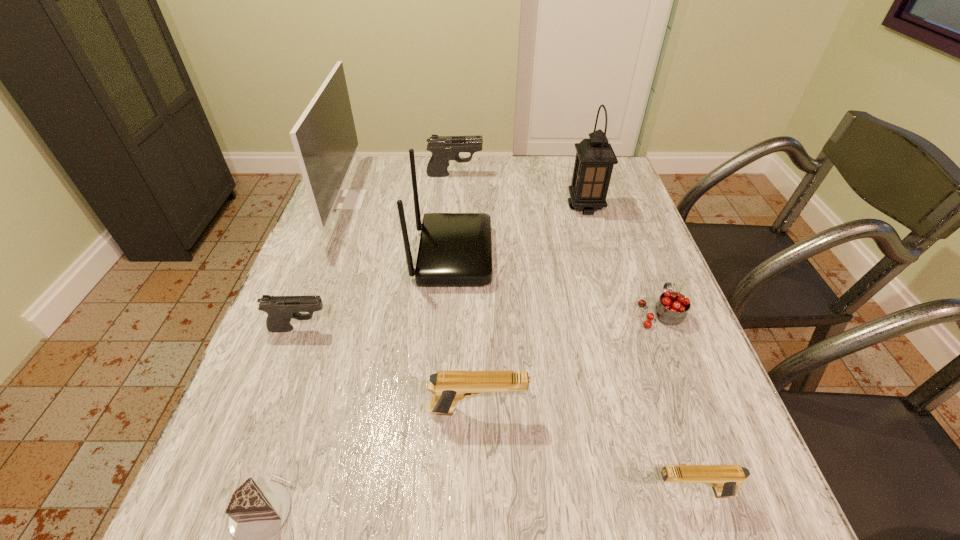
This screenshot has width=960, height=540. What are the coordinates of `cherry that is at the right edge` in the screenshot? It's located at (672, 308).

I want to click on pistol that is at the right edge, so click(725, 479).

Where is `object present at the far left corner`? object present at the far left corner is located at coordinates (324, 138).

This screenshot has height=540, width=960. In order to click on object that is at the near right corner in this screenshot , I will do `click(725, 479)`.

In the image, there is a desktop. In order to click on vacant area at the far edge in this screenshot , I will do (x=483, y=160).

The image size is (960, 540). In the image, there is a desktop. In order to click on vacant space at the near edge in this screenshot , I will do `click(327, 502)`.

Find the location of `vacant space at the left edge of the desktop`. vacant space at the left edge of the desktop is located at coordinates (350, 291).

In the image, there is a desktop. Identify the location of free space at the right edge. This screenshot has height=540, width=960. (686, 351).

This screenshot has height=540, width=960. I want to click on vacant space at the far left corner of the desktop, so click(x=378, y=165).

At what (x,y) coordinates should I click in order to perform the action: click on blank region between the cherry and the black lantern. Please return your answer as a coordinate pair (x, y). The height and width of the screenshot is (540, 960). Looking at the image, I should click on (623, 260).